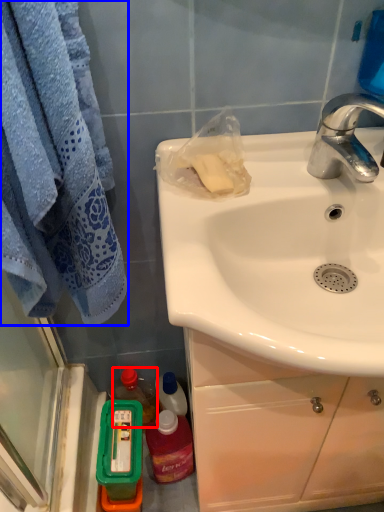
Question: Which point is closer to the camera, bottle (highlighted by a red box) or towel/napkin (highlighted by a blue box)?

Choices:
 (A) bottle
 (B) towel/napkin

Answer: (B)